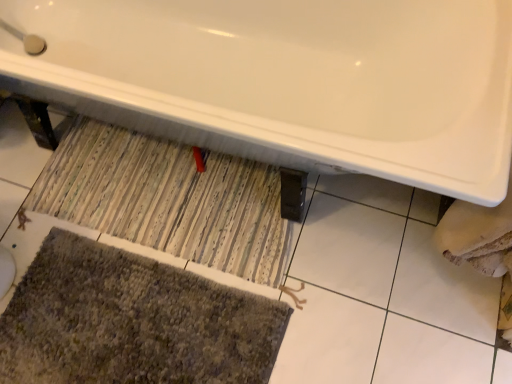
Identify the location of free point to the right of striped fabric doormat at center. (377, 264).